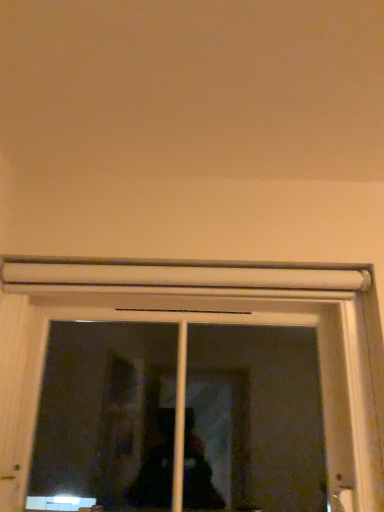
At what (x,y) coordinates should I click in order to perform the action: click on white matte window at center. Please return your answer as a coordinate pair (x, y). The image size is (384, 512). Looking at the image, I should click on (204, 322).

Describe the element at coordinates (204, 322) in the screenshot. I see `white matte window at center` at that location.

You are a GUI agent. You are given a task and a screenshot of the screen. Output one action in this format:
    pyautogui.click(x=<x>, y=<y>)
    Task: Click on the white matte window at center
    The height and width of the screenshot is (512, 384).
    Given the screenshot: What is the action you would take?
    pyautogui.click(x=204, y=322)